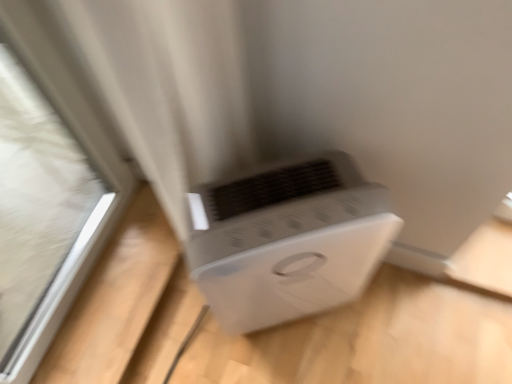
What is the approximate width of white plastic air purifier at center?

white plastic air purifier at center is 9.46 inches in width.

Describe the element at coordinates (287, 240) in the screenshot. I see `white plastic air purifier at center` at that location.

I want to click on white plastic air purifier at center, so click(287, 240).

Where is `white plastic air purifier at center`? The width and height of the screenshot is (512, 384). white plastic air purifier at center is located at coordinates (287, 240).